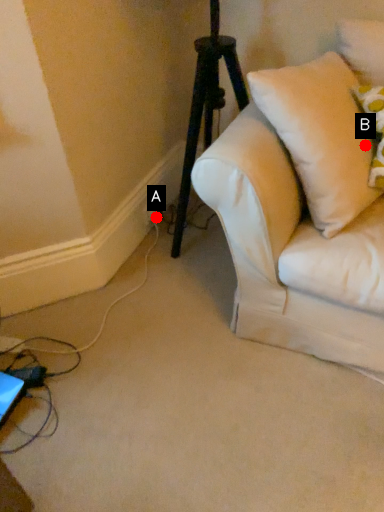
Question: Two points are circled on the image, labeled by A and B beside each circle. Which point appears closest to the camera in this image?

Choices:
 (A) A is closer
 (B) B is closer

Answer: (B)